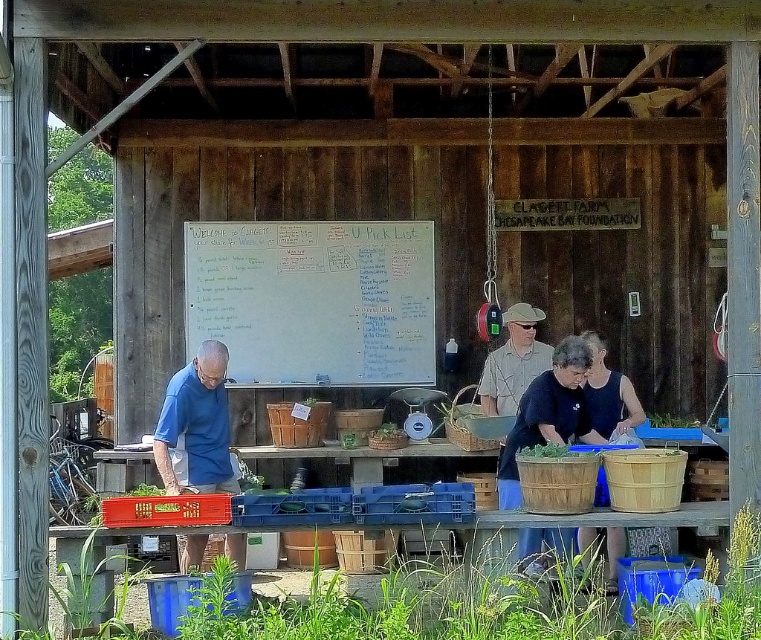
Can you confirm if whiteboard at center is positioned to the left of wooden baskets at center?

Yes, whiteboard at center is to the left of wooden baskets at center.

Can you confirm if whiteboard at center is smaller than wooden baskets at center?

Indeed, whiteboard at center has a smaller size compared to wooden baskets at center.

Locate an element on the screen. whiteboard at center is located at coordinates (314, 300).

Where is `whiteboard at center`? The image size is (761, 640). whiteboard at center is located at coordinates (314, 300).

Which of these two, whiteboard at center or matte brown basket at center, stands taller?

Standing taller between the two is whiteboard at center.

Where is `whiteboard at center`? Image resolution: width=761 pixels, height=640 pixels. whiteboard at center is located at coordinates (314, 300).

Can you confirm if wooden baskets at center is taller than matte brown basket at center?

Correct, wooden baskets at center is much taller as matte brown basket at center.

Between wooden baskets at center and matte brown basket at center, which one is positioned lower?

wooden baskets at center is lower down.

Does point (570, 417) lie in front of point (586, 550)?

No, it is not.

This screenshot has width=761, height=640. Find the location of `wooden baskets at center`. wooden baskets at center is located at coordinates (565, 406).